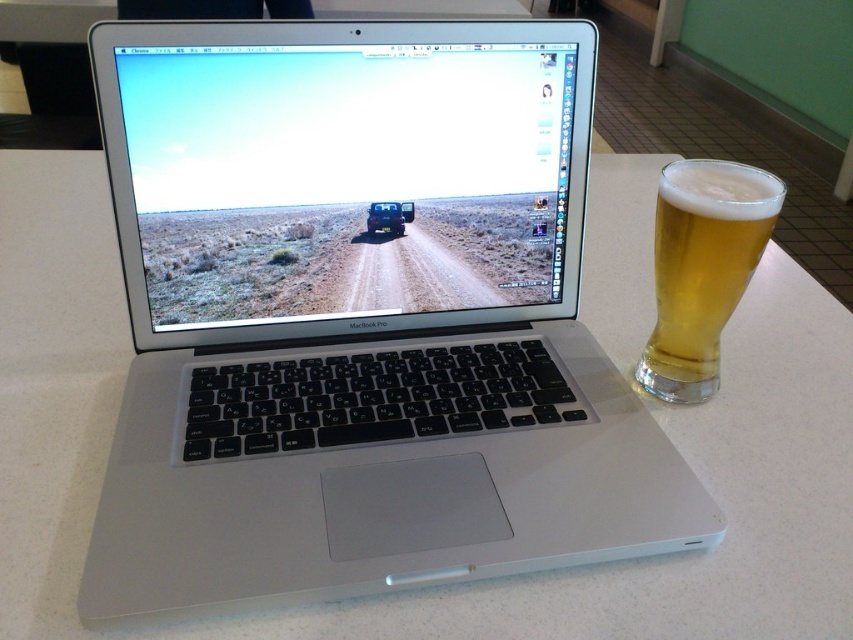
Question: Which point is farther from the camera taking this photo?

Choices:
 (A) (376, 212)
 (B) (689, 401)
 (C) (183, 428)

Answer: (B)

Question: Is silver metallic laptop at center above metallic blue jeep at center?

Choices:
 (A) yes
 (B) no

Answer: (B)

Question: Which object is positioned closest to the metallic blue jeep at center?

Choices:
 (A) silver metallic laptop at center
 (B) golden glass beer at right

Answer: (A)

Question: Which object is farther from the camera taking this photo?

Choices:
 (A) silver metallic laptop at center
 (B) metallic blue jeep at center
 (C) golden glass beer at right

Answer: (B)

Question: Can you confirm if golden glass beer at right is bigger than metallic blue jeep at center?

Choices:
 (A) yes
 (B) no

Answer: (A)

Question: Can you confirm if silver metallic laptop at center is positioned to the right of metallic blue jeep at center?

Choices:
 (A) yes
 (B) no

Answer: (B)